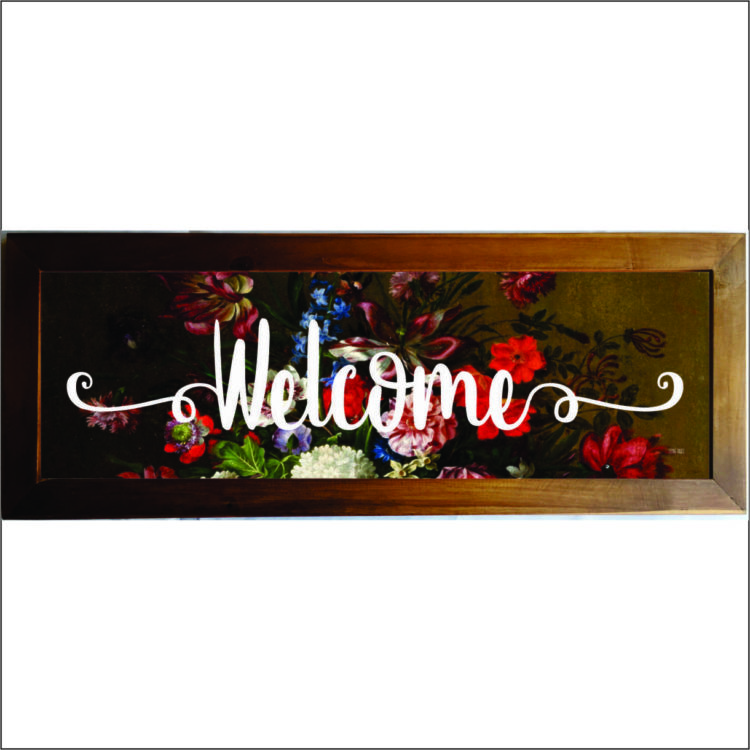
Locate an element on the screen. bottom horizontal segment of frame is located at coordinates (368, 499).